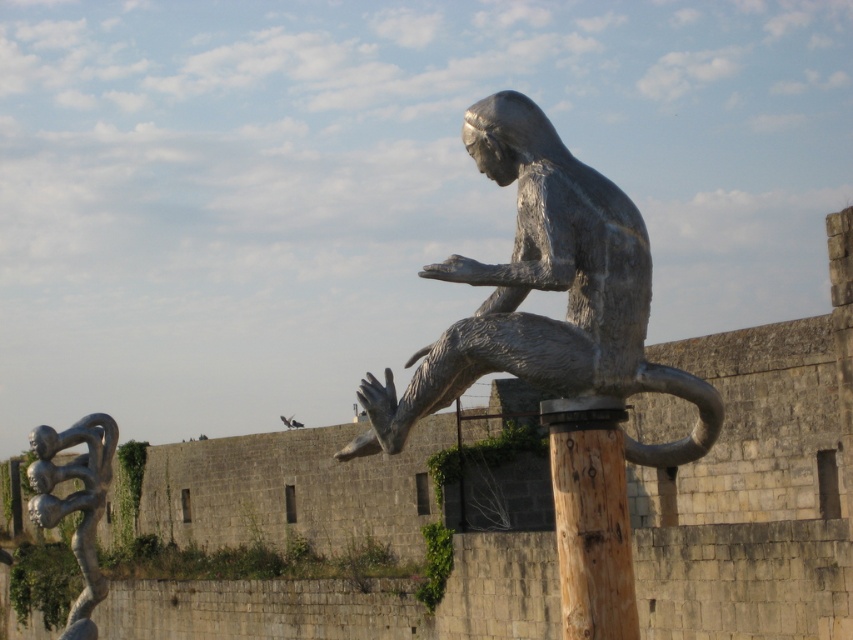
Does polished bronze statue at center have a lesser width compared to polished silver figure at lower left?

Yes.

Which is in front, point (488, 168) or point (86, 464)?

Point (488, 168) is more forward.

The width and height of the screenshot is (853, 640). I want to click on polished bronze statue at center, so point(544,289).

Between polished bronze statue at center and brown wood pole at center, which one has more height?

Standing taller between the two is polished bronze statue at center.

Does polished bronze statue at center have a larger size compared to brown wood pole at center?

Yes, polished bronze statue at center is bigger than brown wood pole at center.

Describe the element at coordinates (544, 289) in the screenshot. This screenshot has height=640, width=853. I see `polished bronze statue at center` at that location.

Find the location of a particular element. polished bronze statue at center is located at coordinates (544, 289).

Looking at this image, does brown wood pole at center have a lesser height compared to polished silver figure at lower left?

Correct, brown wood pole at center is not as tall as polished silver figure at lower left.

Can you confirm if brown wood pole at center is positioned to the right of polished silver figure at lower left?

Correct, you'll find brown wood pole at center to the right of polished silver figure at lower left.

Between point (602, 579) and point (90, 628), which one is positioned in front?

Point (602, 579)

The image size is (853, 640). I want to click on brown wood pole at center, so click(590, 516).